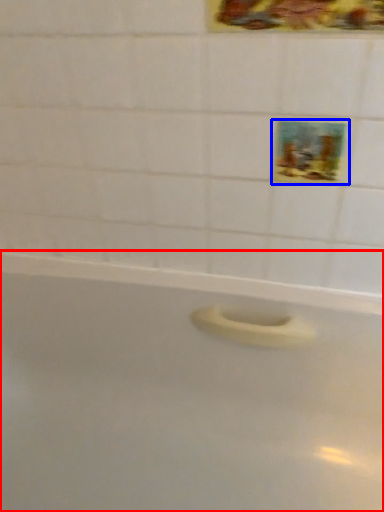
Question: Which object appears farthest to the camera in this image, bathtub (highlighted by a red box) or decorative picture (highlighted by a blue box)?

Choices:
 (A) bathtub
 (B) decorative picture

Answer: (B)